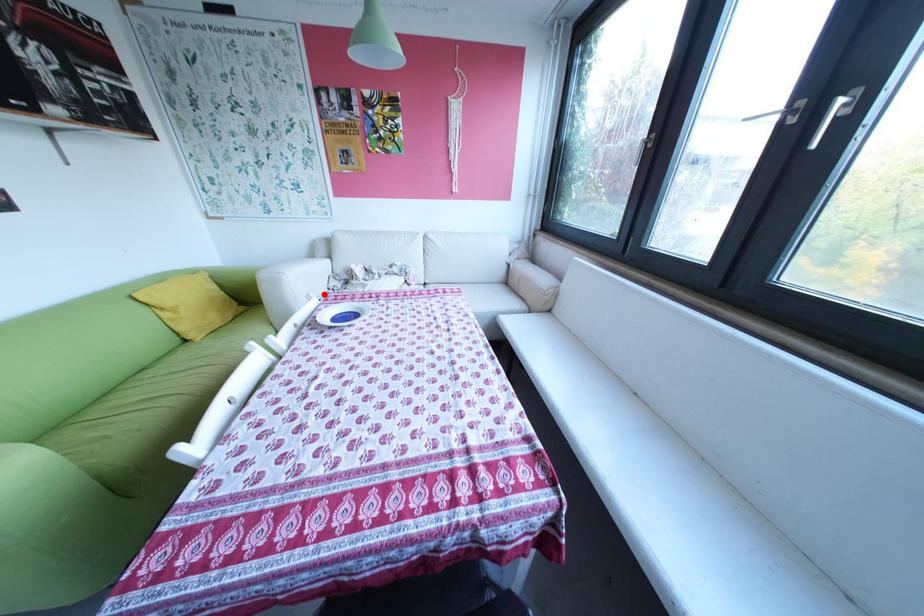
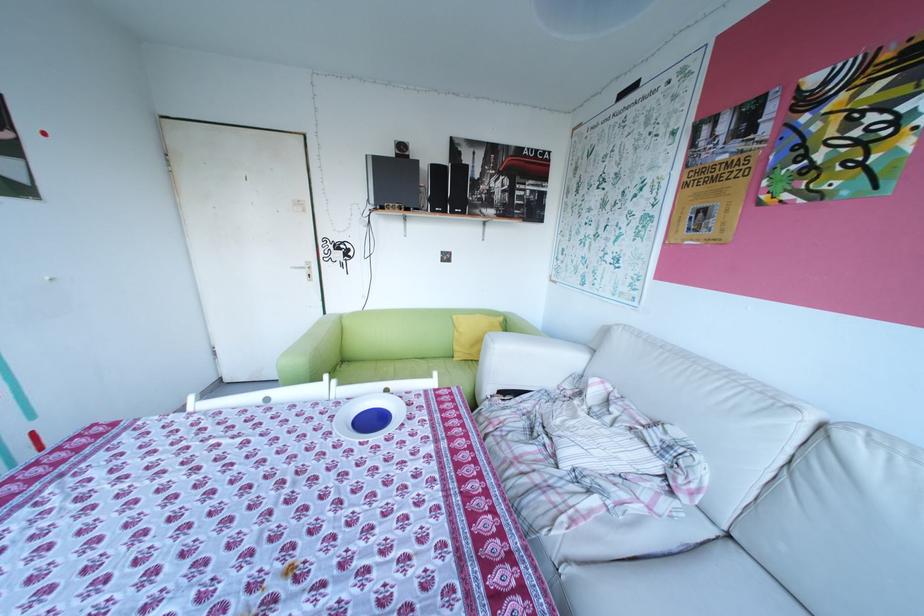
Question: I am providing you with two images of the same scene from different viewpoints. Image1 has a red point marked. In image2, the corresponding 3D location appears at what relative position? Reply with the corresponding letter.

Choices:
 (A) Closer
 (B) Farther

Answer: (A)